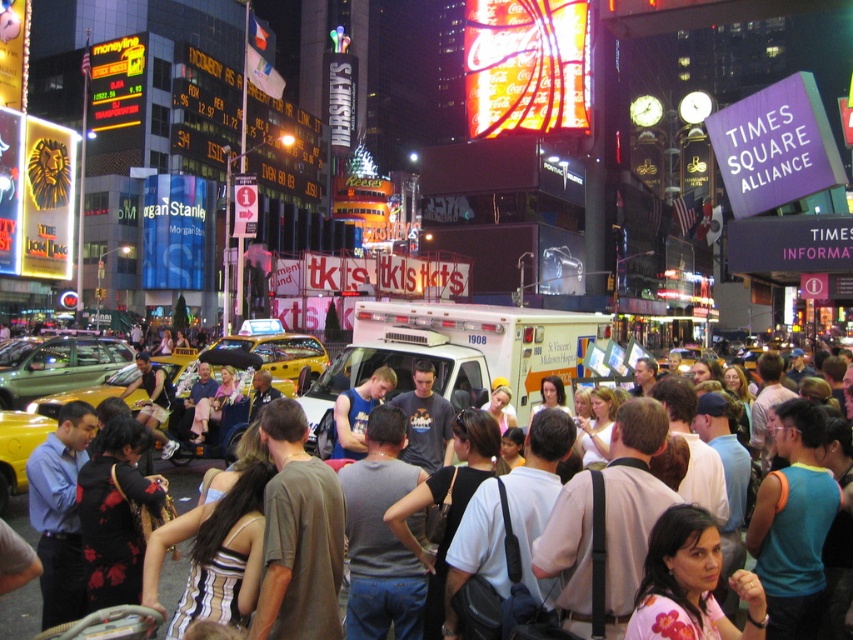
You are standing in Times Square and see two points marked in the image. The first point is at coordinates point (538,106) and the second is at point (21,637). Which point is closer to you?

Point (538,106) is further to the viewer than point (21,637), so the point closer to you is point (21,637).